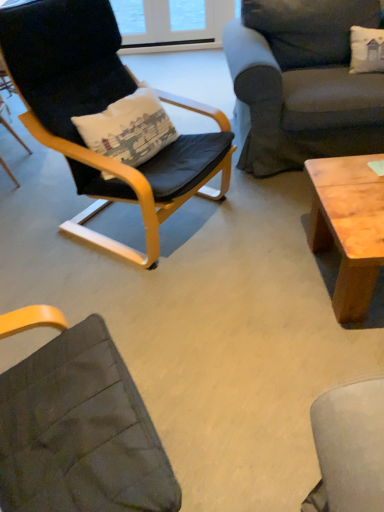
Question: Does dark gray fabric couch at upper right appear on the left side of matte black chair at left, which ranks as the first chair in left-to-right order?

Choices:
 (A) no
 (B) yes

Answer: (A)

Question: Is dark gray fabric couch at upper right wider than matte black chair at left, placed as the second chair when sorted from right to left?

Choices:
 (A) no
 (B) yes

Answer: (B)

Question: Are dark gray fabric couch at upper right and matte black chair at left, placed as the second chair when sorted from right to left, located far from each other?

Choices:
 (A) yes
 (B) no

Answer: (A)

Question: From a real-world perspective, is dark gray fabric couch at upper right over matte black chair at left, placed as the second chair when sorted from right to left?

Choices:
 (A) yes
 (B) no

Answer: (A)

Question: Is dark gray fabric couch at upper right further to camera compared to matte black chair at left, which ranks as the first chair in left-to-right order?

Choices:
 (A) yes
 (B) no

Answer: (B)

Question: From the image's perspective, is black leather chair at left, which is the second chair from left to right, positioned above or below natural wood coffee table at right?

Choices:
 (A) above
 (B) below

Answer: (A)

Question: Is black leather chair at left, which is the second chair from left to right, to the left or to the right of natural wood coffee table at right in the image?

Choices:
 (A) left
 (B) right

Answer: (A)

Question: Is black leather chair at left, which is the second chair from left to right, inside the boundaries of natural wood coffee table at right, or outside?

Choices:
 (A) inside
 (B) outside

Answer: (B)

Question: From their relative heights in the image, would you say black leather chair at left, the first chair when ordered from right to left, is taller or shorter than natural wood coffee table at right?

Choices:
 (A) tall
 (B) short

Answer: (A)

Question: Is matte black chair at left, placed as the second chair when sorted from right to left, situated inside dark gray fabric couch at upper right or outside?

Choices:
 (A) outside
 (B) inside

Answer: (A)

Question: Is point (1, 121) positioned closer to the camera than point (238, 166)?

Choices:
 (A) farther
 (B) closer

Answer: (A)

Question: From a real-world perspective, is matte black chair at left, placed as the second chair when sorted from right to left, above or below dark gray fabric couch at upper right?

Choices:
 (A) above
 (B) below

Answer: (B)

Question: Is matte black chair at left, which ranks as the first chair in left-to-right order, to the left or to the right of dark gray fabric couch at upper right in the image?

Choices:
 (A) left
 (B) right

Answer: (A)

Question: Based on their sizes in the image, would you say matte black chair at left, placed as the second chair when sorted from right to left, is bigger or smaller than black leather chair at left, which is the second chair from left to right?

Choices:
 (A) big
 (B) small

Answer: (B)

Question: Is matte black chair at left, which ranks as the first chair in left-to-right order, inside the boundaries of black leather chair at left, which is the second chair from left to right, or outside?

Choices:
 (A) outside
 (B) inside

Answer: (A)